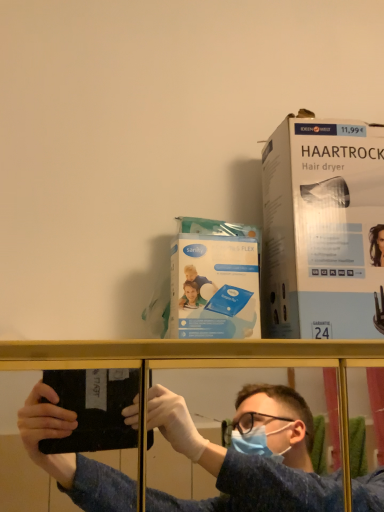
Question: Relative to blue plastic sanitary pads at center, the first paperback book positioned from the left, is blue fabric shirt at center in front or behind?

Choices:
 (A) behind
 (B) front

Answer: (B)

Question: From the image's perspective, relative to blue plastic sanitary pads at center, positioned as the 2th paperback book in right-to-left order, is blue fabric shirt at center above or below?

Choices:
 (A) below
 (B) above

Answer: (A)

Question: Which is nearer to the blue fabric shirt at center?

Choices:
 (A) blue plastic sanitary pads at center, positioned as the 2th paperback book in right-to-left order
 (B) white cardboard box at upper right, the 2th paperback book in the left-to-right sequence

Answer: (B)

Question: Considering the real-world distances, which object is farthest from the white cardboard box at upper right, marked as the first paperback book in a right-to-left arrangement?

Choices:
 (A) blue fabric shirt at center
 (B) blue plastic sanitary pads at center, the first paperback book positioned from the left

Answer: (A)